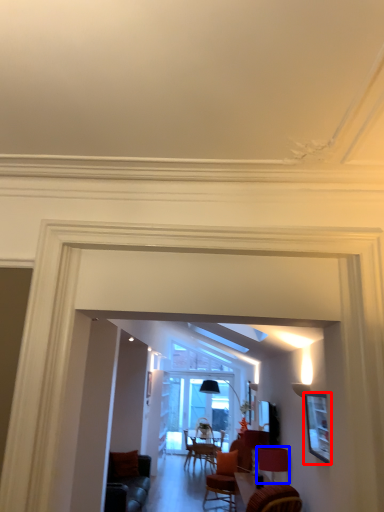
Question: Which object is closer to the camera taking this photo, picture frame (highlighted by a red box) or lamp (highlighted by a blue box)?

Choices:
 (A) picture frame
 (B) lamp

Answer: (A)